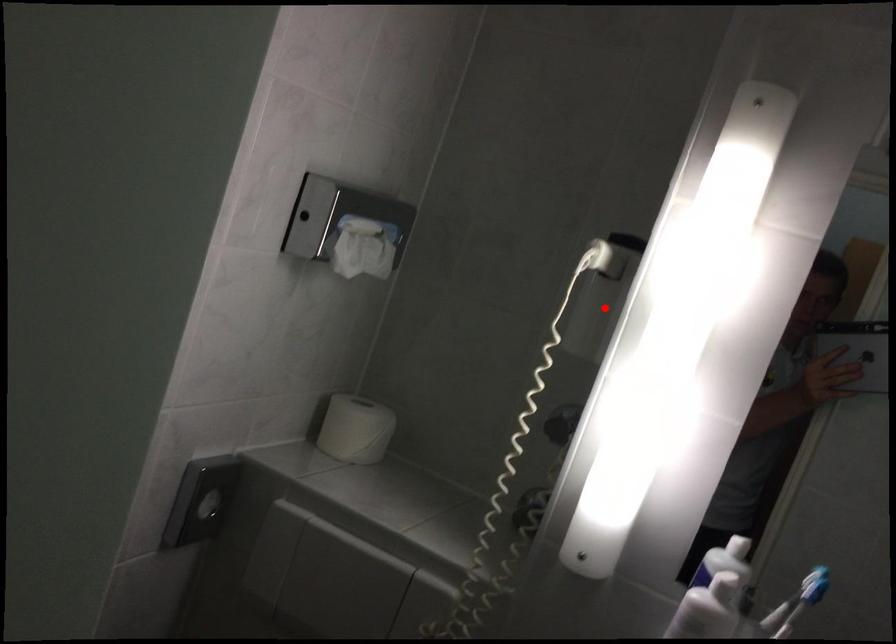
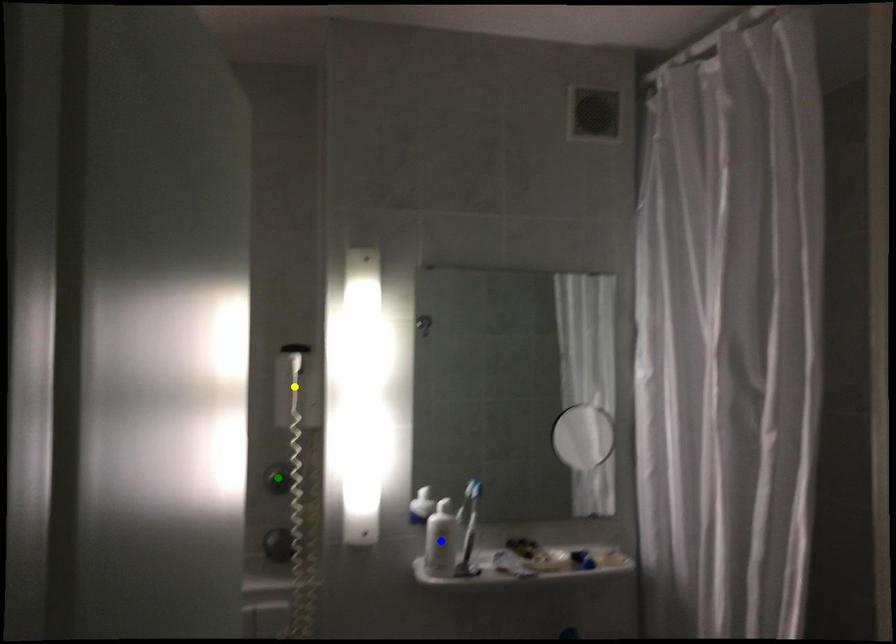
Question: I am providing you with two images of the same scene from different viewpoints. A red point is marked on the first image. You are given multiple points on the second image. Which point in image 2 is actually the same real-world point as the red point in image 1?

Choices:
 (A) yellow point
 (B) green point
 (C) blue point

Answer: (A)